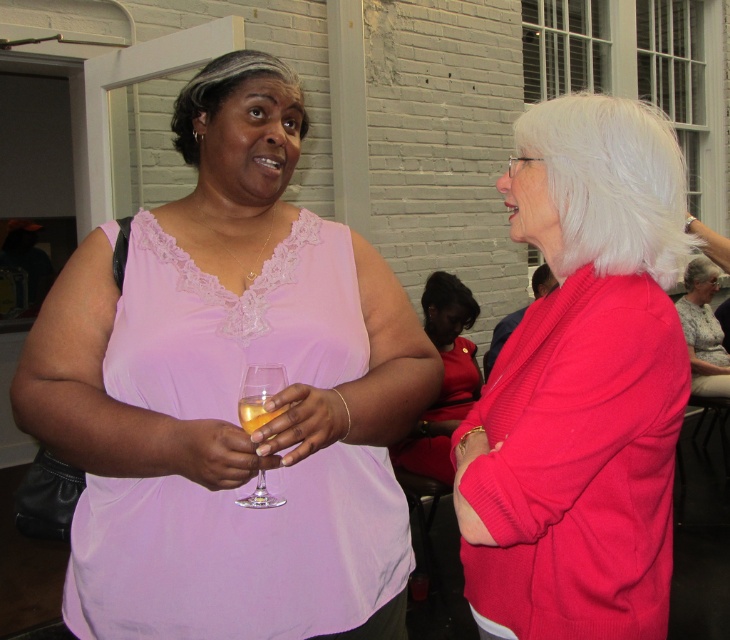
Between matte pink blouse at center and matte red dress at center, which one is positioned lower?

matte red dress at center is below.

Looking at this image, who is positioned more to the right, matte pink blouse at center or matte red dress at center?

Positioned to the right is matte pink blouse at center.

Image resolution: width=730 pixels, height=640 pixels. I want to click on matte pink blouse at center, so click(580, 387).

This screenshot has width=730, height=640. I want to click on matte pink blouse at center, so click(x=580, y=387).

Can you confirm if matte red dress at center is positioned to the left of printed fabric blouse at center?

Indeed, matte red dress at center is positioned on the left side of printed fabric blouse at center.

Is matte red dress at center shorter than printed fabric blouse at center?

No.

The image size is (730, 640). What do you see at coordinates (442, 378) in the screenshot?
I see `matte red dress at center` at bounding box center [442, 378].

Locate an element on the screen. The image size is (730, 640). matte red dress at center is located at coordinates (442, 378).

Who is shorter, printed fabric blouse at center or clear glass wine glass at center?

clear glass wine glass at center is shorter.

Does point (723, 392) come in front of point (253, 387)?

No, (723, 392) is behind (253, 387).

Which is behind, point (703, 353) or point (258, 474)?

The point (703, 353) is behind.

Identify the location of printed fabric blouse at center. (703, 330).